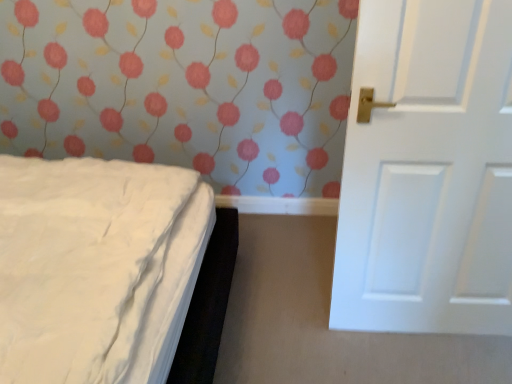
Question: From a real-world perspective, is white matte door at right positioned above or below white soft bed at left?

Choices:
 (A) below
 (B) above

Answer: (A)

Question: Is point (460, 57) closer or farther from the camera than point (89, 235)?

Choices:
 (A) closer
 (B) farther

Answer: (A)

Question: Would you say white matte door at right is inside or outside white soft bed at left?

Choices:
 (A) outside
 (B) inside

Answer: (A)

Question: Considering the relative positions of white soft bed at left and white matte door at right in the image provided, is white soft bed at left to the left or to the right of white matte door at right?

Choices:
 (A) left
 (B) right

Answer: (A)

Question: Choose the correct answer: Is white soft bed at left inside white matte door at right or outside it?

Choices:
 (A) outside
 (B) inside

Answer: (A)

Question: Is white soft bed at left taller or shorter than white matte door at right?

Choices:
 (A) tall
 (B) short

Answer: (A)

Question: In the image, is white soft bed at left positioned in front of or behind white matte door at right?

Choices:
 (A) behind
 (B) front

Answer: (B)